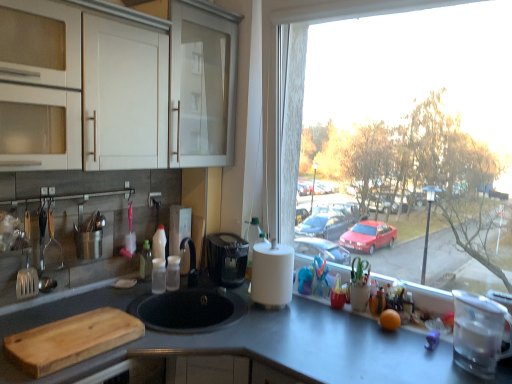
Question: Looking at their shapes, would you say wooden cutting board at lower left is wider or thinner than satin nickel faucet at center, positioned as the 1th appliance in left-to-right order?

Choices:
 (A) wide
 (B) thin

Answer: (A)

Question: Is wooden cutting board at lower left in front of or behind satin nickel faucet at center, placed as the second appliance when sorted from front to back, in the image?

Choices:
 (A) behind
 (B) front

Answer: (B)

Question: Which of these objects is positioned closest to the white glossy cabinet at upper left?

Choices:
 (A) white matte paper towel at center
 (B) transparent plastic bottle at sink
 (C) transparent glass water filter at right, the 1th appliance from the right
 (D) white glossy cabinet at upper left
 (E) transparent glass window at right

Answer: (D)

Question: Which of these objects is positioned closest to the transparent glass window at right?

Choices:
 (A) transparent glass water filter at right, which is counted as the 1th appliance, starting from the front
 (B) white matte paper towel at center
 (C) satin nickel faucet at center, placed as the second appliance when sorted from front to back
 (D) metallic spatula at left
 (E) white glossy cabinet at upper left

Answer: (E)